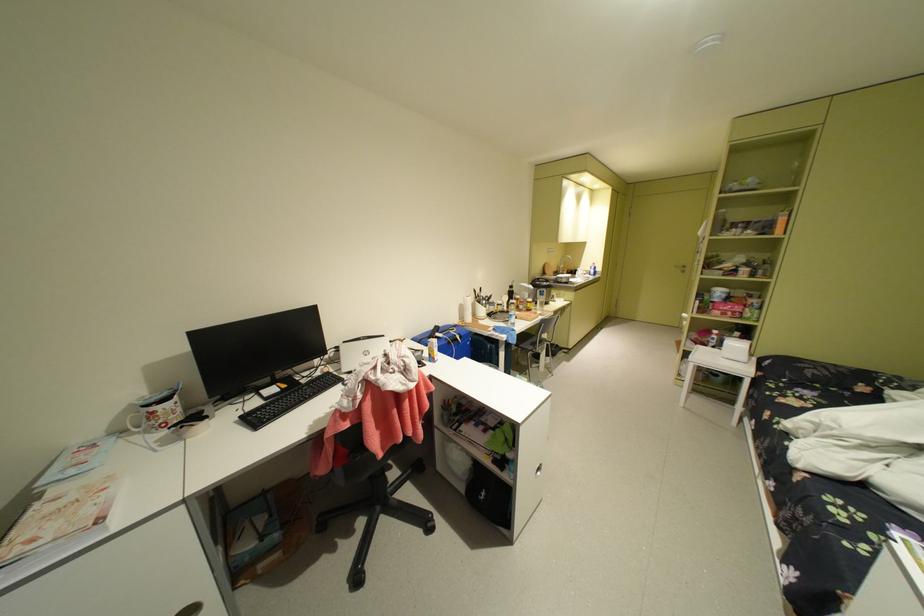
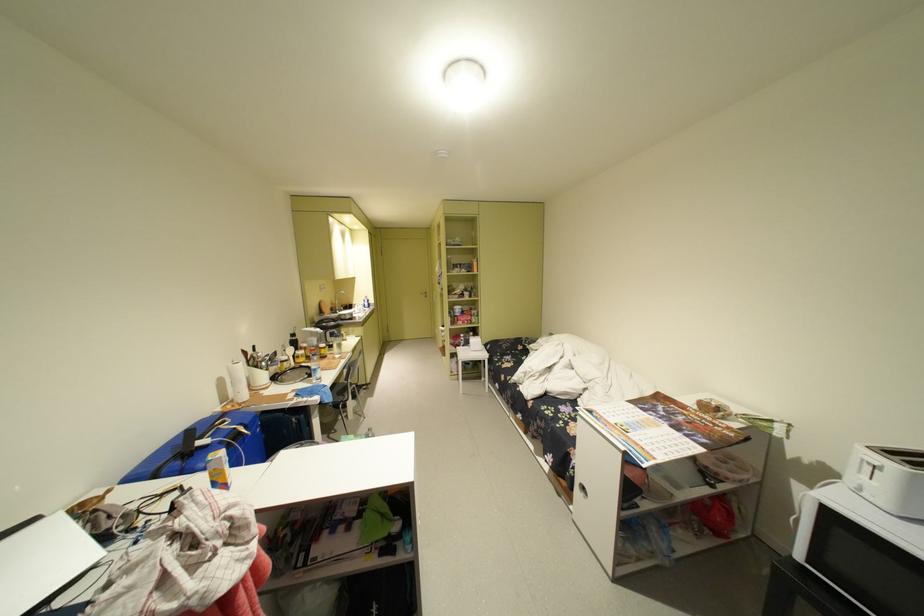
Where in the second image is the point corresponding to point 440,344 from the first image?

(220, 464)